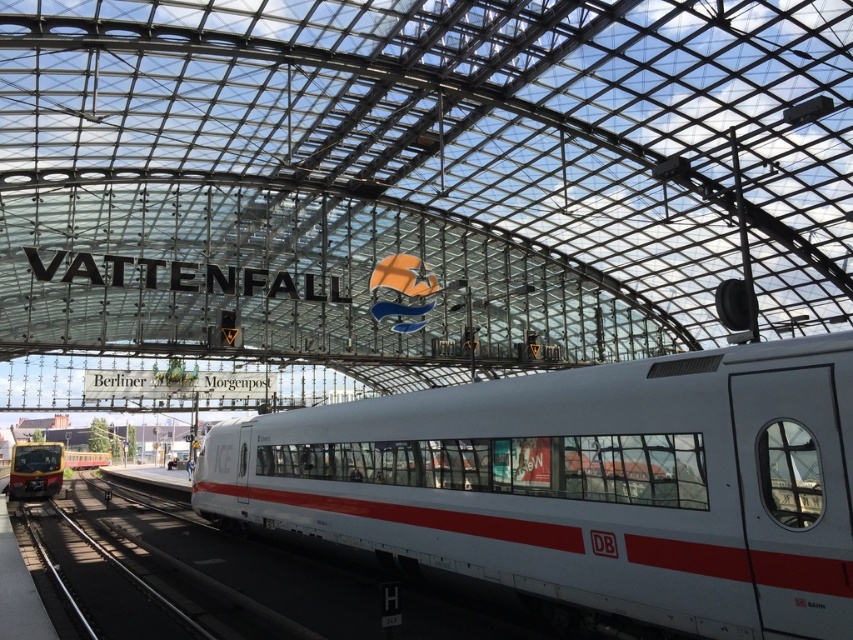
You are standing at the entrance of the train station and want to take a photo of the point at coordinates (206,470). Your camera has a focal length of 50mm and a sensor size of 24mm x 36mm. What is the minimum distance you need to move closer to ensure the point fills the frame vertically?

The point is 23.37 meters away from the camera. To calculate the minimum distance needed, use the formula for field of view. The vertical FOV is 2 arctan24mm25mm. Wait, the sensor size is 24mm height and 36mm width. So vertical FOV is 2 arctan24mm25mm? Wait, maybe I should use the sensor height divided by the focal length. The vertical FOV is 2 times arctangent of half the sensor height divided by focal length. So sensor height is 24mm, so half is 12mm. Focal length is 50mm. So FOV is 2 arctan12mm50mm. Let

Consider the image. You are a maintenance worker inspecting the train station. You need to determine which train is taller between the white glossy train at center and the matte black train at lower left. Based on the scene, which one is taller?

The white glossy train at center is taller than the matte black train at lower left according to the description provided.